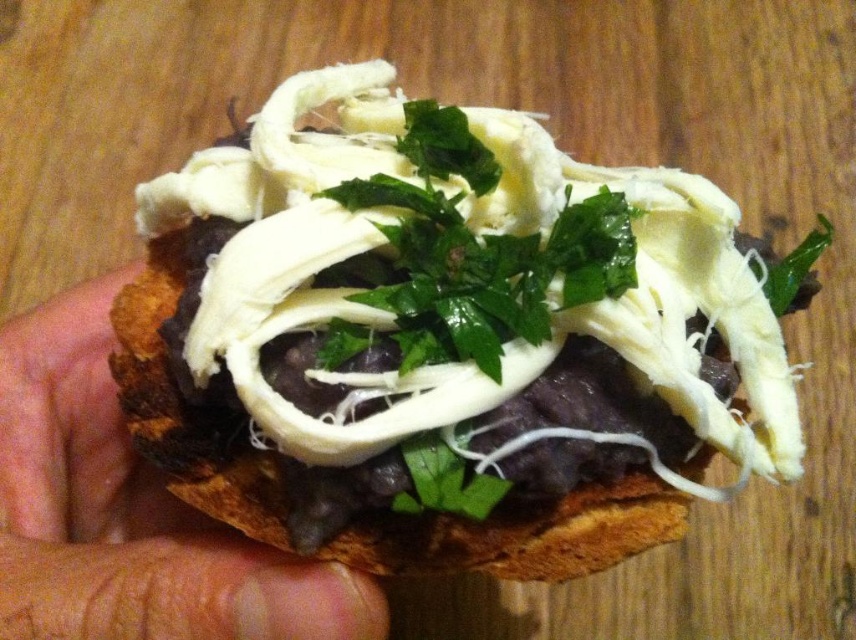
Question: Which object appears farthest from the camera in this image?

Choices:
 (A) brown skin at center
 (B) white creamy cheese at center

Answer: (A)

Question: Is white creamy cheese at center smaller than brown skin at center?

Choices:
 (A) no
 (B) yes

Answer: (A)

Question: Where is white creamy cheese at center located in relation to brown skin at center in the image?

Choices:
 (A) right
 (B) left

Answer: (A)

Question: Can you confirm if white creamy cheese at center is positioned to the left of brown skin at center?

Choices:
 (A) yes
 (B) no

Answer: (B)

Question: Among these points, which one is farthest from the camera?

Choices:
 (A) (91, 424)
 (B) (348, 65)

Answer: (B)